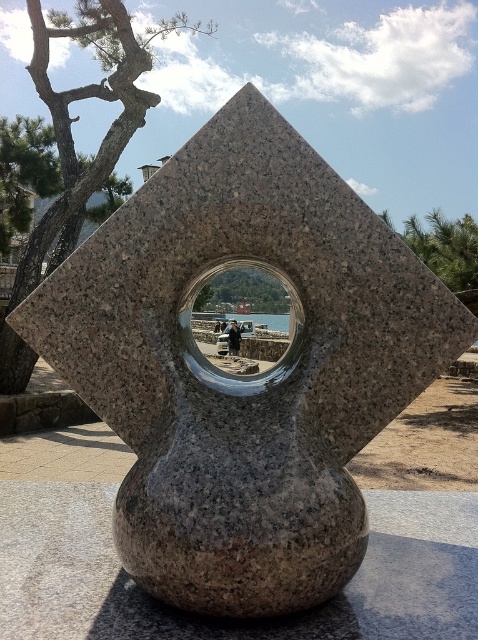
Based on the photo, you are an artist observing the sculpture and want to place a small golden statue exactly between the transparent glass hole at center and transparent glass water at center. Based on their positions, which object should you use as a reference point to ensure the statue is centered?

The transparent glass water at center should be used as the reference point because the transparent glass hole at center is positioned to its right, so placing the statue halfway between them would require aligning it relative to the water feature.